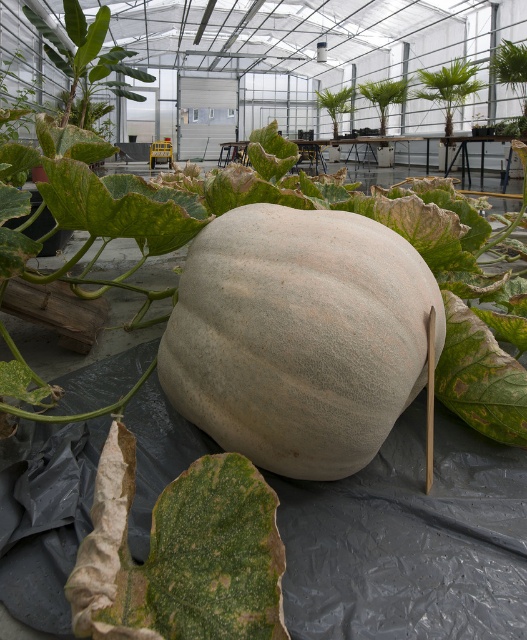
From the picture: You are standing in the greenhouse and see the point marked at coordinates (317, 209). What object is located at that point?

The point at coordinates (317, 209) marks the smooth beige pumpkin at center.

You are a gardener who needs to water the green leafy plant at upper center. The smooth beige pumpkin at center is blocking your path. Can you walk around it to reach the plant?

The smooth beige pumpkin at center is in front of the green leafy plant at upper center, so you can walk around the pumpkin to access the plant since it is blocking the direct path but not the entire area.

You are a gardener standing at the entrance of the greenhouse. You want to reach the smooth beige pumpkin at center to inspect its growth. Considering your average stride length of 2.5 feet, how many steps do you need to take to reach it?

The smooth beige pumpkin at center is 3.36 feet away from the camera. With an average stride length of 2.5 feet, you would need approximately 2 steps to reach it since 3.36 divided by 2.5 is about 1.34, so rounding up to the nearest whole number gives 2 steps.